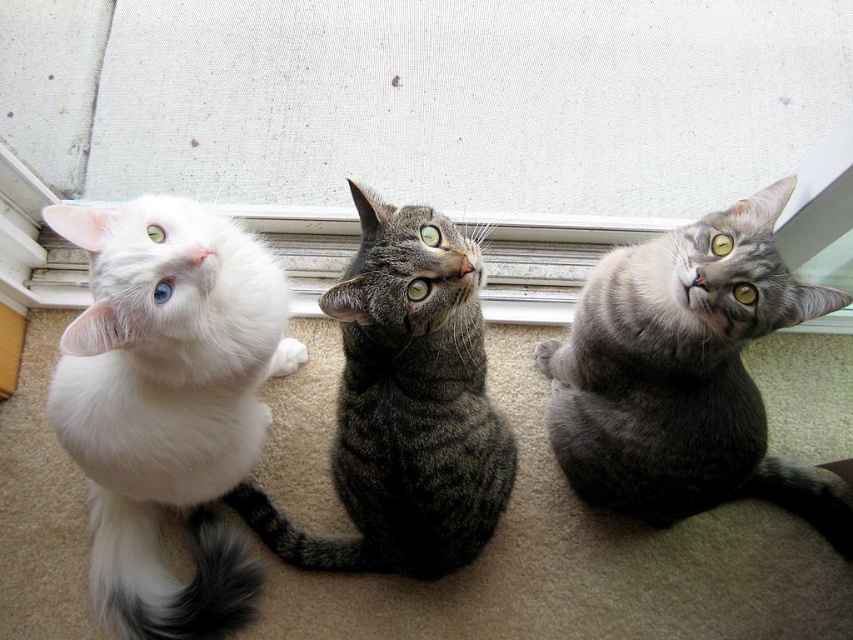
You are a photographer aiming to capture a photo of the gray tabby cat at center. The camera you are using has a laser pointer to attract the cat. If you point the laser pointer at the coordinates given in the description, will the cat move towards the laser? Please explain your reasoning.

The gray tabby cat at center is located at point (683, 372). If the laser pointer is pointed at those coordinates, the cat may move towards it as it is a common reaction for cats to chase laser dots. However, the effectiveness depends on the cat individual preferences and current mood.

You are trying to pet the cats in the image. The gray tabby cat at center and the tabby fur cat at center are both in your way. Which cat should you move first to reach the one behind?

You should move the gray tabty cat at center first because it is closer to you than the tabby fur cat at center, which is behind it.